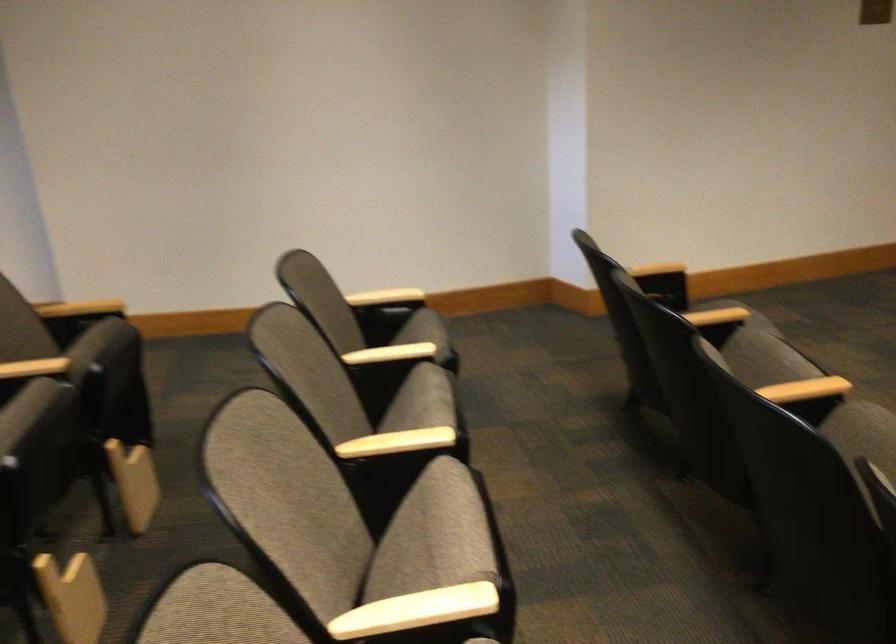
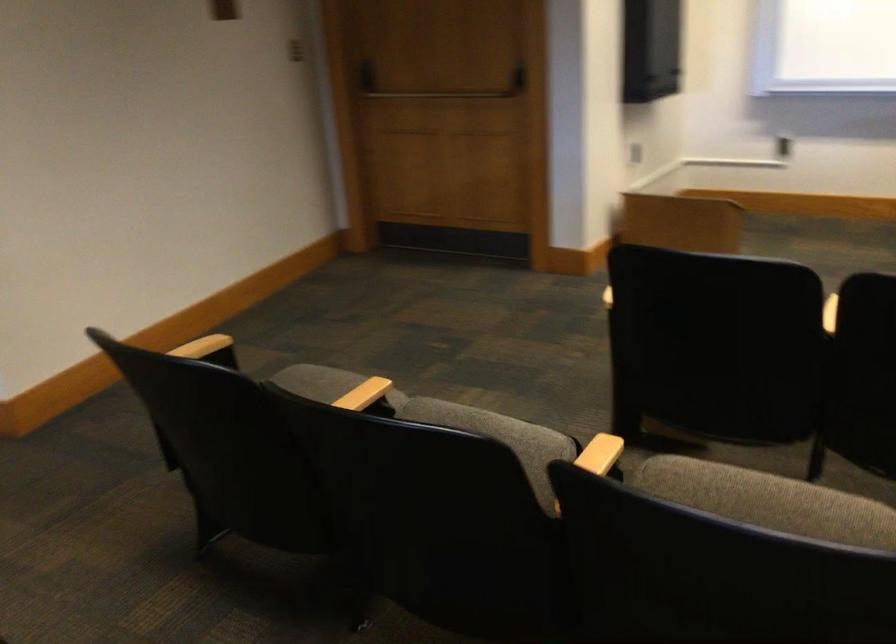
Where in the second image is the point corresponding to point (777, 348) from the first image?

(490, 426)